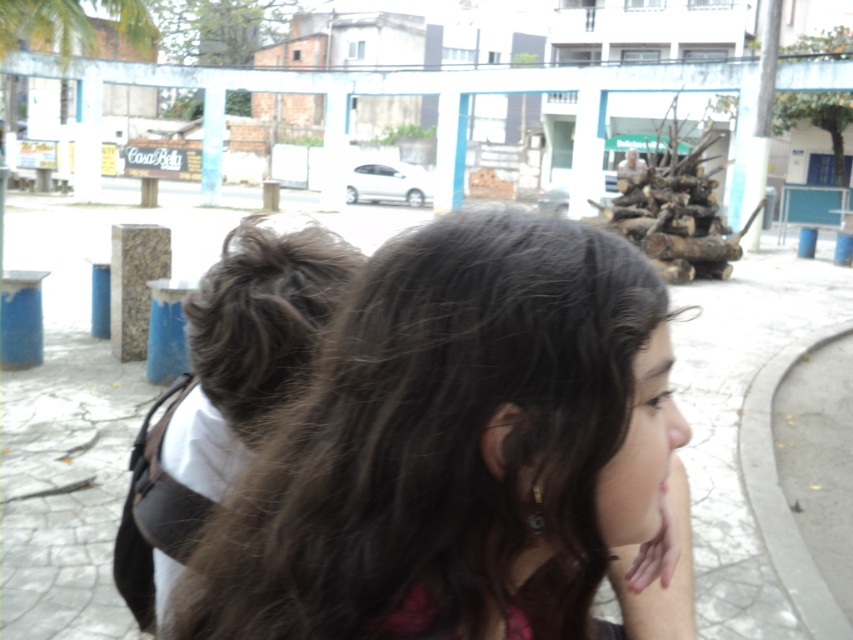
You are standing at the center of the street and want to take a photo of the dark brown hair at center and the green leafy palm tree at upper left. Which object is closer to you?

The dark brown hair at center is closer to you since it is only 18.88 meters away from the green leafy palm tree at upper left, meaning the dark brown hair at center is nearer to your position at the center of the street.

You are a photographer trying to capture a photo of the dark brown hair at center and the green leafy palm tree at upper left in the scene. Which object is positioned higher in the image?

The green leafy palm tree at upper left is positioned higher in the image than the dark brown hair at center.